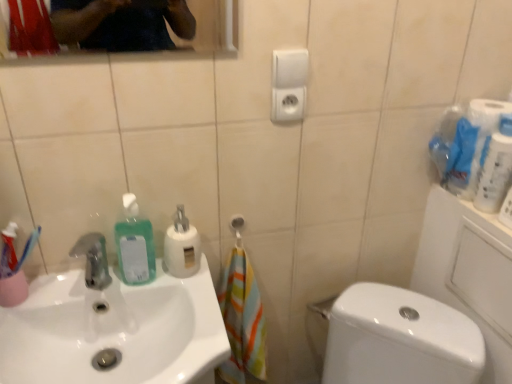
Question: Is white glossy toilet at lower right to the right of white glossy sink at lower left from the viewer's perspective?

Choices:
 (A) yes
 (B) no

Answer: (A)

Question: Is white glossy toilet at lower right looking in the opposite direction of white glossy sink at lower left?

Choices:
 (A) yes
 (B) no

Answer: (B)

Question: From a real-world perspective, is white glossy toilet at lower right physically above white glossy sink at lower left?

Choices:
 (A) no
 (B) yes

Answer: (A)

Question: Does white glossy toilet at lower right have a greater height compared to white glossy sink at lower left?

Choices:
 (A) no
 (B) yes

Answer: (B)

Question: Can you confirm if white glossy toilet at lower right is bigger than white glossy sink at lower left?

Choices:
 (A) no
 (B) yes

Answer: (B)

Question: Is white glossy toilet at lower right spatially inside white matte soap dispenser at center, the 2th cleaning product viewed from the left, or outside of it?

Choices:
 (A) inside
 (B) outside

Answer: (B)

Question: In terms of width, does white glossy toilet at lower right look wider or thinner when compared to white matte soap dispenser at center, which is the 1th cleaning product in right-to-left order?

Choices:
 (A) wide
 (B) thin

Answer: (A)

Question: From the image's perspective, relative to white matte soap dispenser at center, the 2th cleaning product viewed from the left, is white glossy toilet at lower right above or below?

Choices:
 (A) below
 (B) above

Answer: (A)

Question: Is point (330, 337) positioned closer to the camera than point (181, 248)?

Choices:
 (A) farther
 (B) closer

Answer: (A)

Question: Based on their positions, is white matte soap dispenser at center, which is the 1th cleaning product in right-to-left order, located to the left or right of white glossy toilet at lower right?

Choices:
 (A) right
 (B) left

Answer: (B)

Question: In the image, is white matte soap dispenser at center, which is the 1th cleaning product in right-to-left order, positioned in front of or behind white glossy toilet at lower right?

Choices:
 (A) front
 (B) behind

Answer: (B)

Question: From a real-world perspective, is white matte soap dispenser at center, the 2th cleaning product viewed from the left, above or below white glossy toilet at lower right?

Choices:
 (A) above
 (B) below

Answer: (A)

Question: Based on their sizes in the image, would you say white matte soap dispenser at center, which is the 1th cleaning product in right-to-left order, is bigger or smaller than white glossy toilet at lower right?

Choices:
 (A) small
 (B) big

Answer: (A)

Question: From a real-world perspective, relative to green translucent liquid at sink left, positioned as the second cleaning product in right-to-left order, is white glossy sink at lower left vertically above or below?

Choices:
 (A) below
 (B) above

Answer: (A)

Question: From the image's perspective, is white glossy sink at lower left located above or below green translucent liquid at sink left, arranged as the first cleaning product when viewed from the left?

Choices:
 (A) below
 (B) above

Answer: (A)